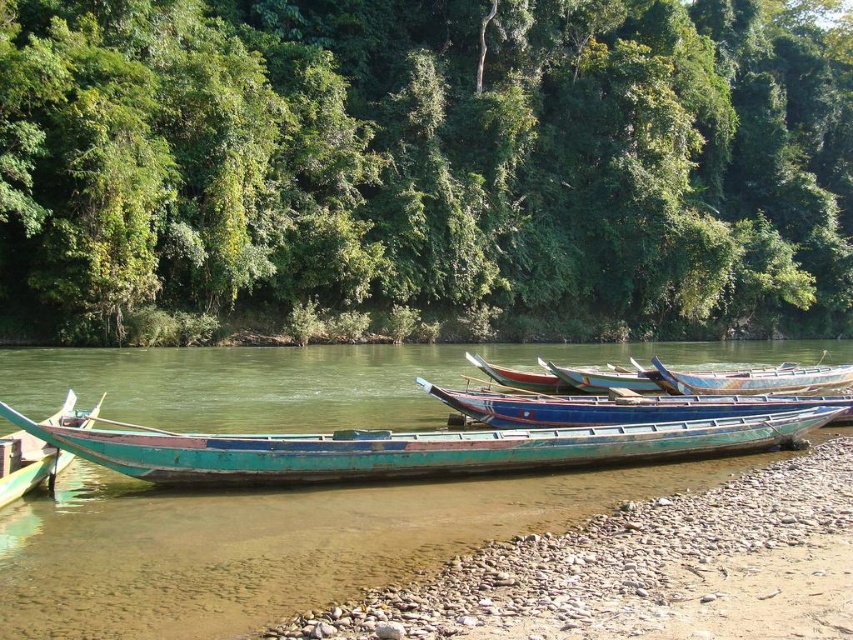
Looking at this image, is the position of teal wooden boat at center more distant than that of wooden planks boat at center?

No, it is not.

Locate an element on the screen. The image size is (853, 640). teal wooden boat at center is located at coordinates (409, 449).

How much distance is there between green leafy trees at upper center and green wood shoreline at lower left?

green leafy trees at upper center and green wood shoreline at lower left are 191.54 feet apart.

Which is behind, point (325, 211) or point (532, 577)?

Point (325, 211)

The image size is (853, 640). In order to click on green leafy trees at upper center in this screenshot , I will do `click(428, 164)`.

Is green wood shoreline at lower left positioned behind blue painted wood canoe at center?

No, it is not.

Describe the element at coordinates (645, 570) in the screenshot. The width and height of the screenshot is (853, 640). I see `green wood shoreline at lower left` at that location.

I want to click on green wood shoreline at lower left, so click(645, 570).